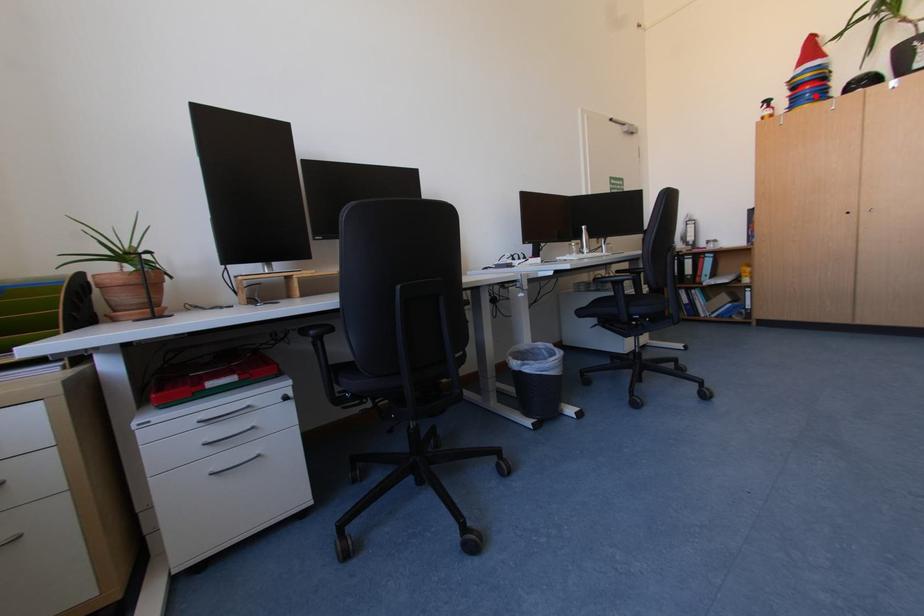
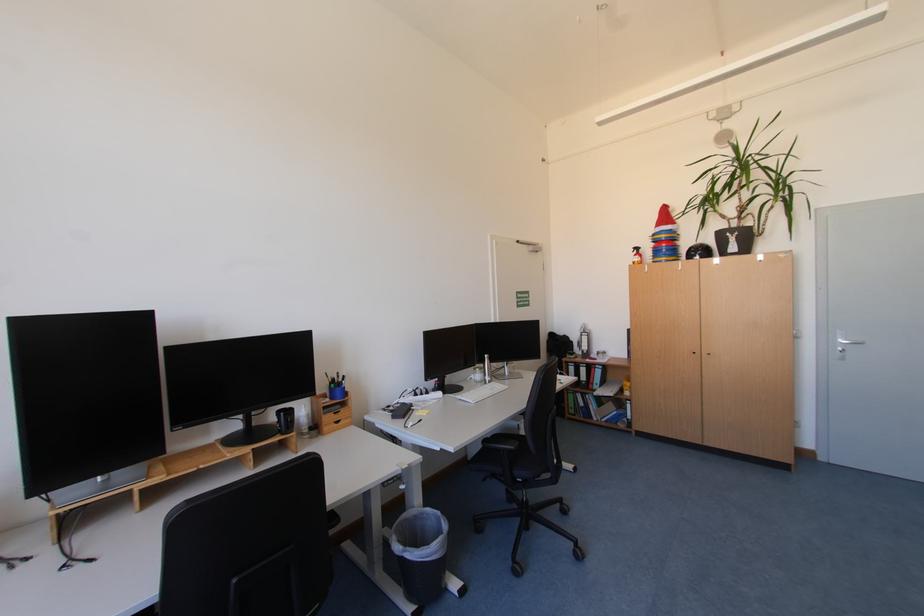
Question: I am providing you with two images of the same scene from different viewpoints. Image1 has a red point marked. In image2, the corresponding 3D location appears at what relative position? Reply with the corresponding letter.

Choices:
 (A) Closer
 (B) Farther

Answer: (A)